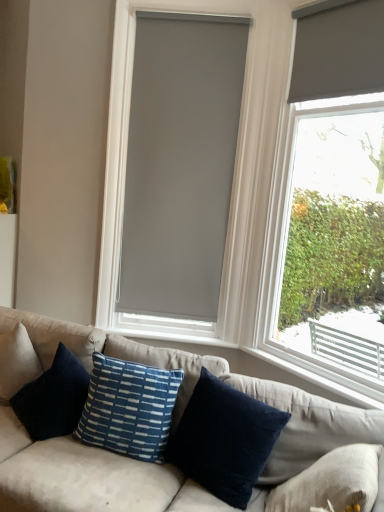
At what (x,y) coordinates should I click in order to perform the action: click on free point above gray matte blind at center, placed as the first window blind when sorted from left to right (from a real-world perspective). Please return your answer as a coordinate pair (x, y). Looking at the image, I should click on (187, 12).